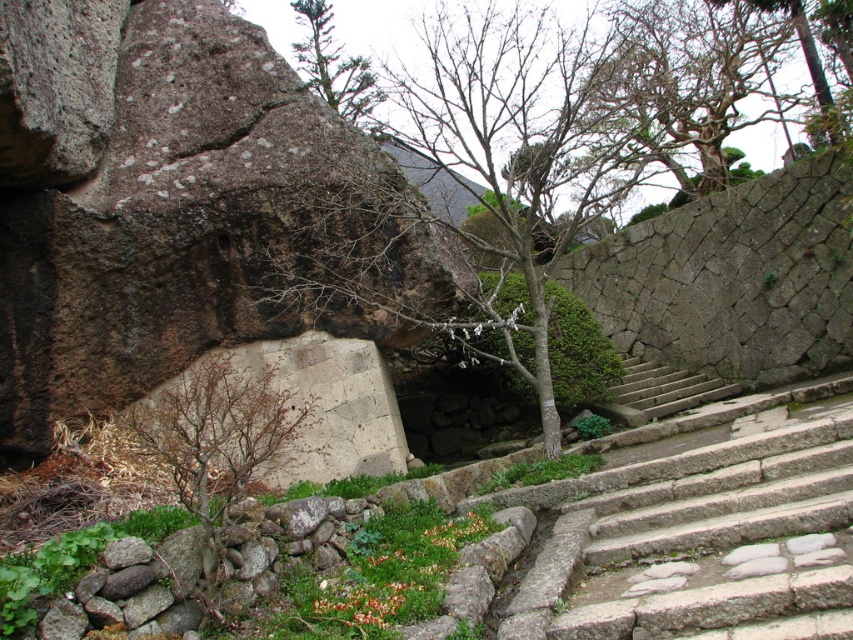
You are standing in the outdoor scene and want to place a small flag at both point (798, 65) and point (706, 387). Which point is closer to you where you are standing?

Point (706, 387) is closer to you because it is less further to the camera than point (798, 65).

You are standing at the base of the gray stone stairs at center and want to climb them to reach the green leafy tree at upper center. Can you see the top of the tree from the bottom of the stairs?

The green leafy tree at upper center is taller than the gray stone stairs at center, so yes, you can see the top of the tree from the bottom of the stairs since the tree is taller than the stairs.

You are a bird looking for a place to perch. You see the green leafy tree at upper center. Based on its position, can you estimate how far it is from the top edge of the image?

The green leafy tree at upper center is located at point 0.103 from the left and 0.393 from the top edge of the image. Since the question asks for distance from the top edge, the vertical coordinate 0.393 represents the fraction of the image height. If the image height is H, the distance from the top would be approximately 0.393H.